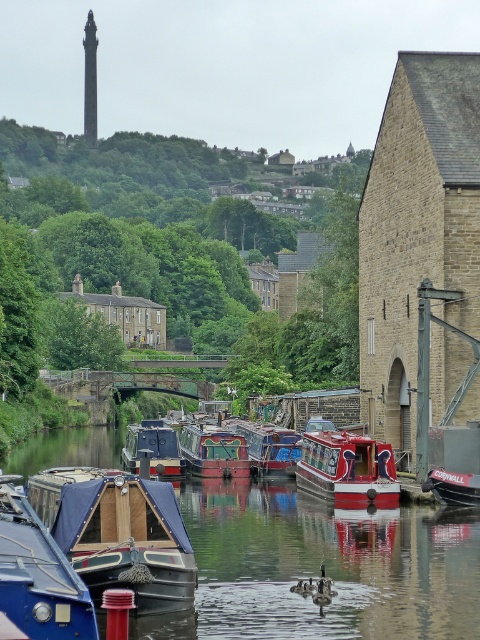
Question: Is wooden polished boat at center below red polished wood boat at center?

Choices:
 (A) no
 (B) yes

Answer: (B)

Question: Among these points, which one is farthest from the camera?

Choices:
 (A) (180, 474)
 (B) (432, 474)

Answer: (A)

Question: Does blue canvas boat at lower left appear on the right side of red polished wood boat at lower right?

Choices:
 (A) yes
 (B) no

Answer: (B)

Question: Which point is closer to the camera?

Choices:
 (A) smooth wooden boat at lower left
 (B) blue canvas boat at center

Answer: (A)

Question: Which object is positioned closest to the red polished wood boat at lower right?

Choices:
 (A) smooth wooden boat at lower left
 (B) shiny red boat at center
 (C) red polished wood boat at center
 (D) matte blue boat at center

Answer: (B)

Question: Does blue canvas boat at lower left appear on the left side of red polished wood boat at lower right?

Choices:
 (A) yes
 (B) no

Answer: (A)